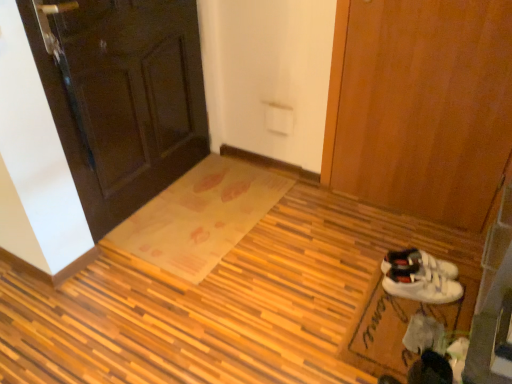
Find the location of a particular element. empty space that is in between dark wood door at upper left, the 1th door from the left, and wooden door at right, the 2th door positioned from the left is located at coordinates (272, 212).